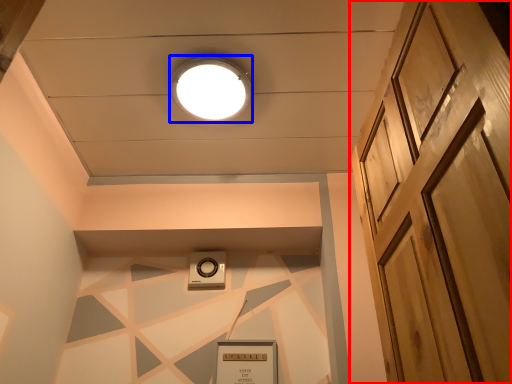
Question: Which point is closer to the camera, door (highlighted by a red box) or droplight (highlighted by a blue box)?

Choices:
 (A) door
 (B) droplight

Answer: (A)